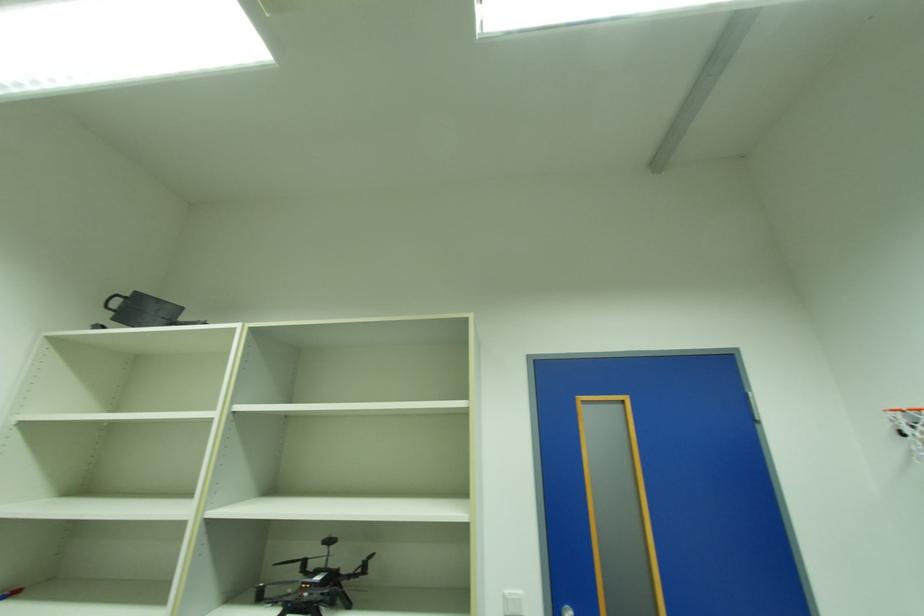
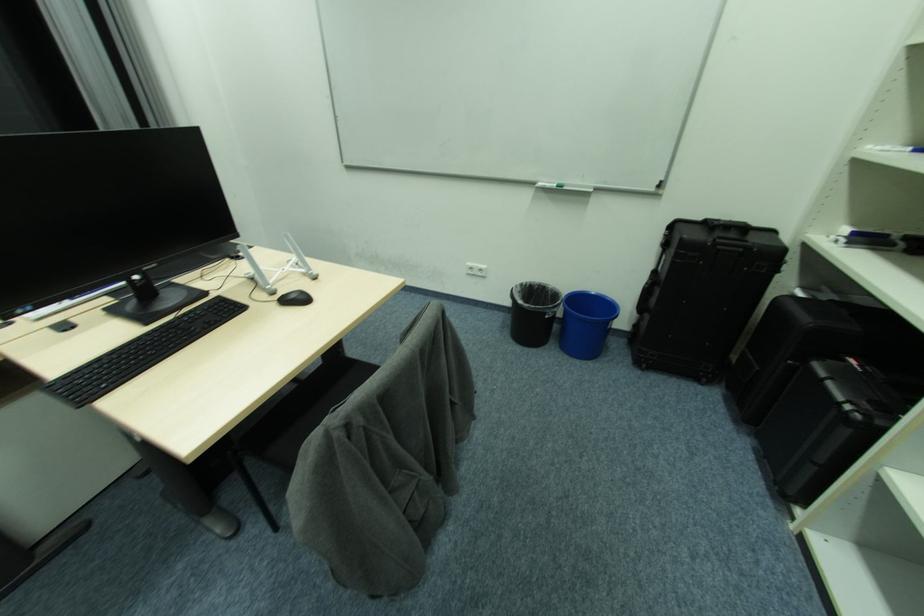
The first image is from the beginning of the video and the second image is from the end. How did the camera likely rotate when shooting the video?

The camera's rotation is toward left-down.